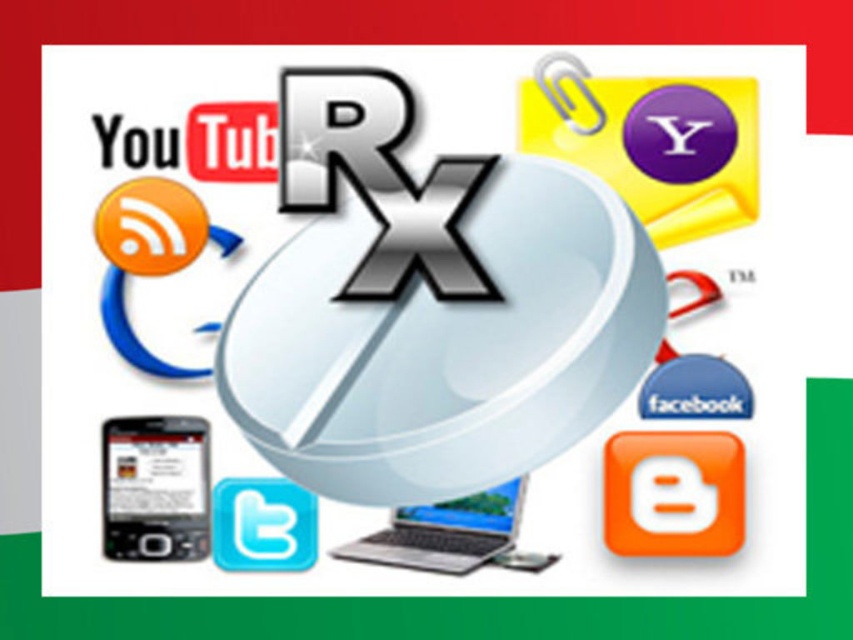
You are a graphic designer working on a pharmaceutical advertisement. You need to place a black glossy phone at bottom left at point (155, 488). The advertisement already has a central white pill with RX symbol, a YouTube logo at top left, a Yahoo logo next to it, and a Facebook logo to the right of the pill. Is there enough space to place the phone without overlapping any existing elements?

The black glossy phone at bottom left can be placed at point (155, 488) without overlapping existing elements because it is located at the bottom left, away from the central pill, top left YouTube and Yahoo logos, and the Facebook logo to the right of the pill.

You are designing a digital advertisement layout for a pharmaceutical company. The ad must include both the black glossy phone at bottom left and the satin silver laptop at center. Given their sizes, which device should be placed closer to the central pill icon to maintain visual balance?

The satin silver laptop at center is wider than the black glossy phone at bottom left, so placing the laptop closer to the central pill icon would help balance the layout since its larger size can counterbalance the central focus.

You are designing a poster for a pharmaceutical company. You need to ensure that the black glossy phone at bottom left and the satin silver laptop at center are arranged in a way that the taller device is placed at the bottom for stability. Based on the scene description, which device should be positioned at the bottom?

The black glossy phone at bottom left is taller than the satin silver laptop at center, so it should be placed at the bottom for stability.